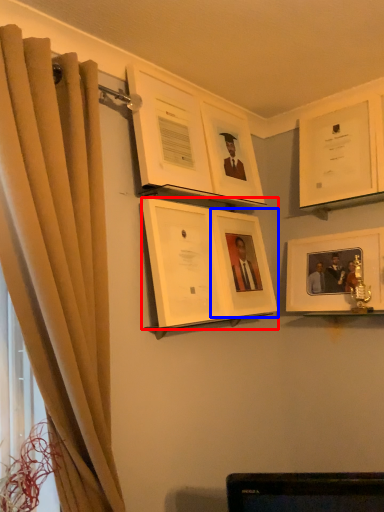
Question: Which object appears closest to the camera in this image, picture frame (highlighted by a red box) or picture frame (highlighted by a blue box)?

Choices:
 (A) picture frame
 (B) picture frame

Answer: (A)